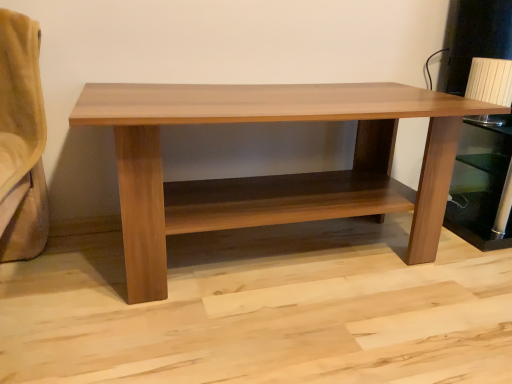
Locate an element on the screen. The image size is (512, 384). empty space that is ontop of wooden table at center is located at coordinates (301, 94).